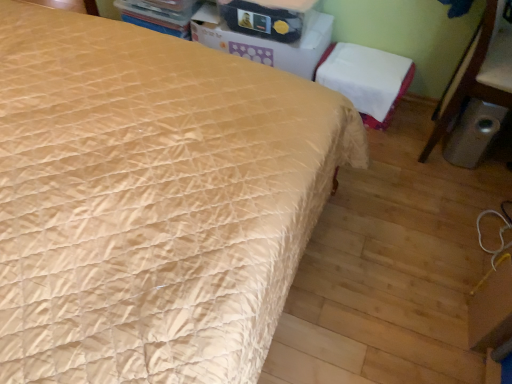
Where is `vacant area on top of white fabric chair at upper right (from a real-world perspective)`? The image size is (512, 384). vacant area on top of white fabric chair at upper right (from a real-world perspective) is located at coordinates (371, 64).